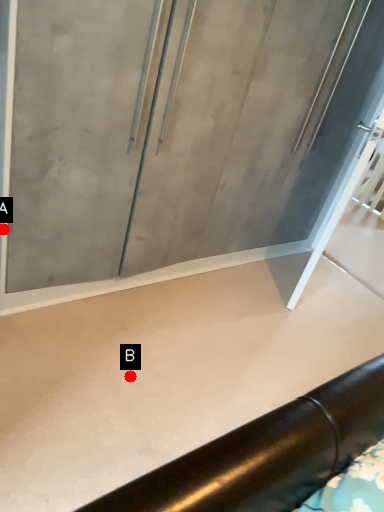
Question: Two points are circled on the image, labeled by A and B beside each circle. Which point is farther from the camera taking this photo?

Choices:
 (A) A is further
 (B) B is further

Answer: (B)